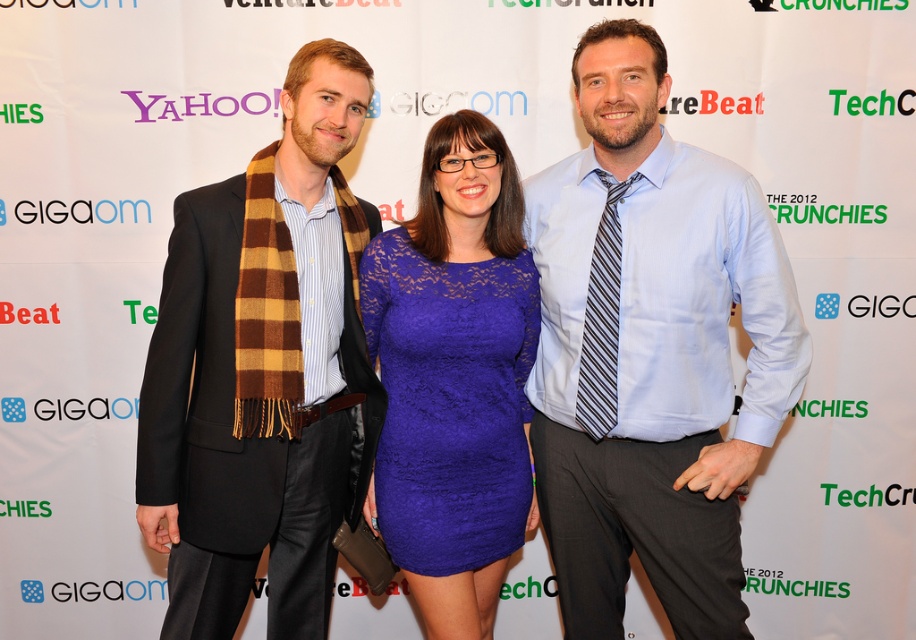
You are a photographer at the event and need to capture a closeup of both the light blue shirt at center and the lace blue dress at center. Given that your camera has a 12 inch focus range, will you be able to focus on both items simultaneously?

The light blue shirt at center is 11.13 inches away from the lace blue dress at center. Since the distance between them is less than the camera focus range of 12 inches, the camera can focus on both items simultaneously.

You are a photographer at the event and need to adjust the lighting to ensure both the brown plaid scarf at left and the lace blue dress at center are well lit. Since the scarf is much taller than the dress, which object should you focus the light on first to ensure proper exposure?

The brown plaid scarf at left is much taller than the lace blue dress at center, so you should focus the light on the brown plaid scarf at left first to ensure it is properly exposed before adjusting for the lace blue dress at center.